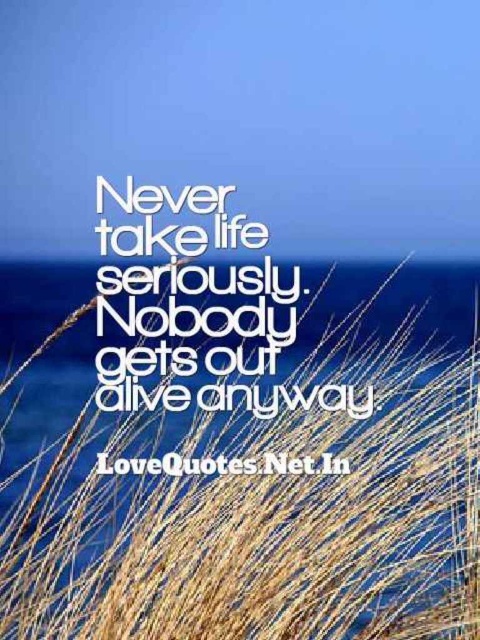
Question: Is white paper at center above white text at center?

Choices:
 (A) no
 (B) yes

Answer: (B)

Question: Which point appears farthest from the camera in this image?

Choices:
 (A) (428, 369)
 (B) (303, 472)
 (C) (133, 355)

Answer: (A)

Question: Can you confirm if white paper at center is smaller than white text at center?

Choices:
 (A) no
 (B) yes

Answer: (A)

Question: Which object appears closest to the camera in this image?

Choices:
 (A) white text at center
 (B) brown dry grass at center

Answer: (B)

Question: Can you confirm if white paper at center is positioned to the right of white text at center?

Choices:
 (A) yes
 (B) no

Answer: (B)

Question: Which object is positioned farthest from the brown dry grass at center?

Choices:
 (A) white text at center
 (B) white paper at center

Answer: (A)